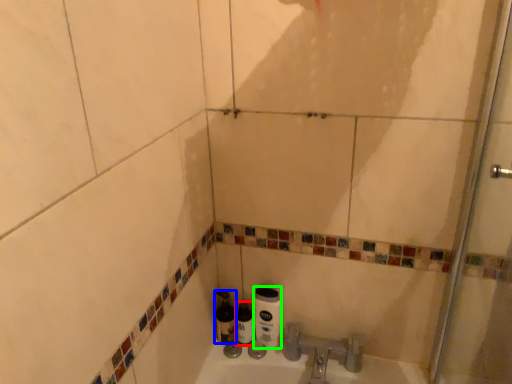
Question: Estimate the real-world distances between objects in this image. Which object is farther from bottle (highlighted by a red box), bottle (highlighted by a blue box) or toilet paper (highlighted by a green box)?

Choices:
 (A) bottle
 (B) toilet paper

Answer: (B)